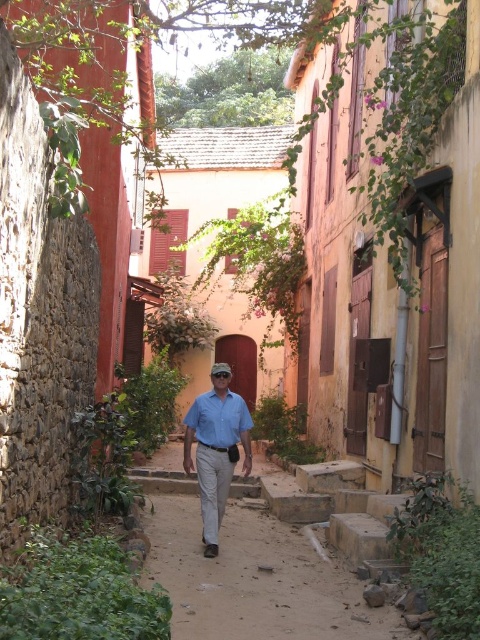
You are a tailor who needs to determine which shirt to alter first. You have a matte blue shirt at center and a blue cotton shirt at center. Based on their sizes, which shirt requires more fabric to adjust?

The matte blue shirt at center has a larger width than the blue cotton shirt at center, so it requires more fabric to adjust.

You are a tailor observing two shirts in an alleyway scene. You notice a matte blue shirt at center and a blue cotton shirt at center. Which shirt is taller?

The matte blue shirt at center is taller than the blue cotton shirt at center.